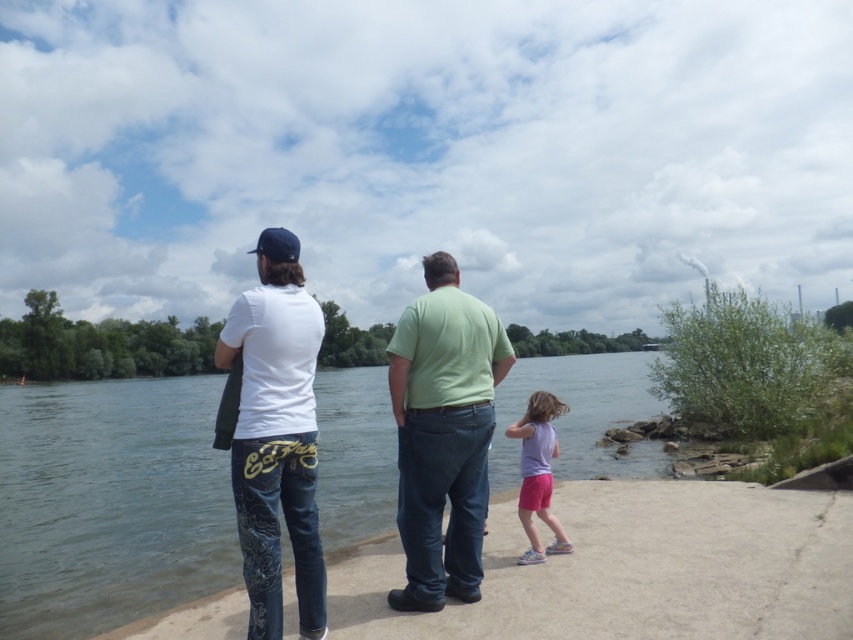
You are standing at the riverside and want to walk towards the two points marked in the image. Which point, point (225, 444) or point (537, 435), will you reach first?

Point (225, 444) is closer to the viewer than point (537, 435), so you will reach point (225, 444) first.